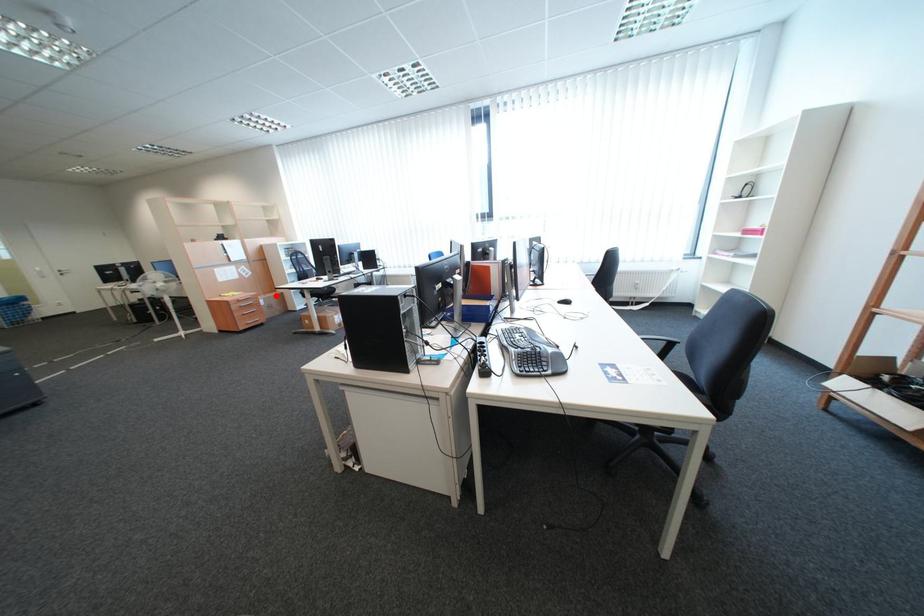
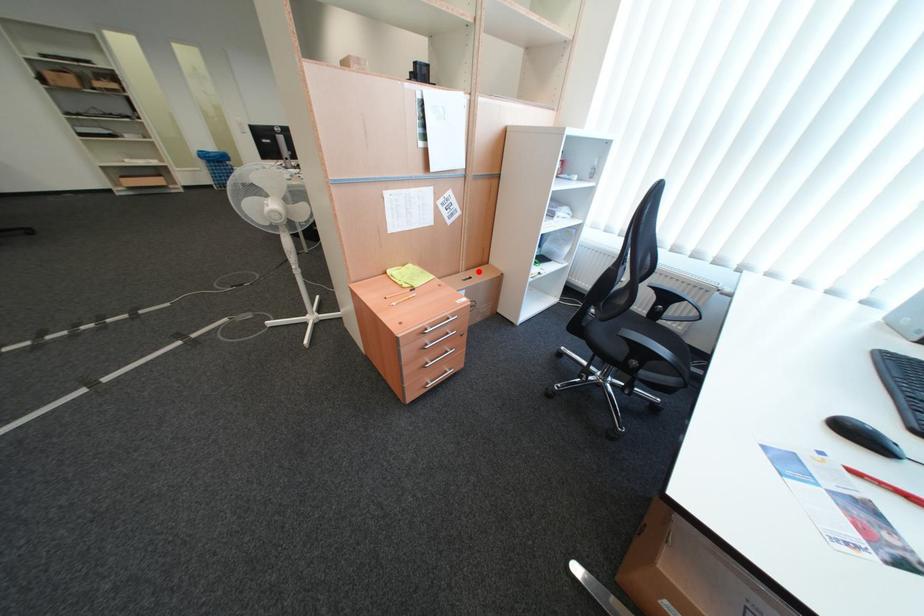
I am providing you with two images of the same scene from different viewpoints. A red point is marked on the first image and another point is marked on the second image. Are the points marked in image1 and image2 representing the same 3D position?

Yes